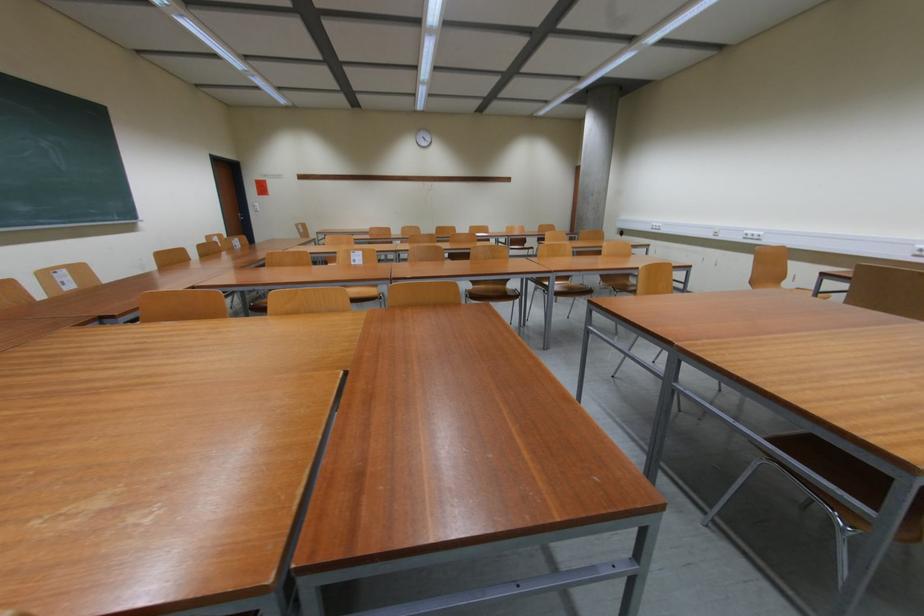
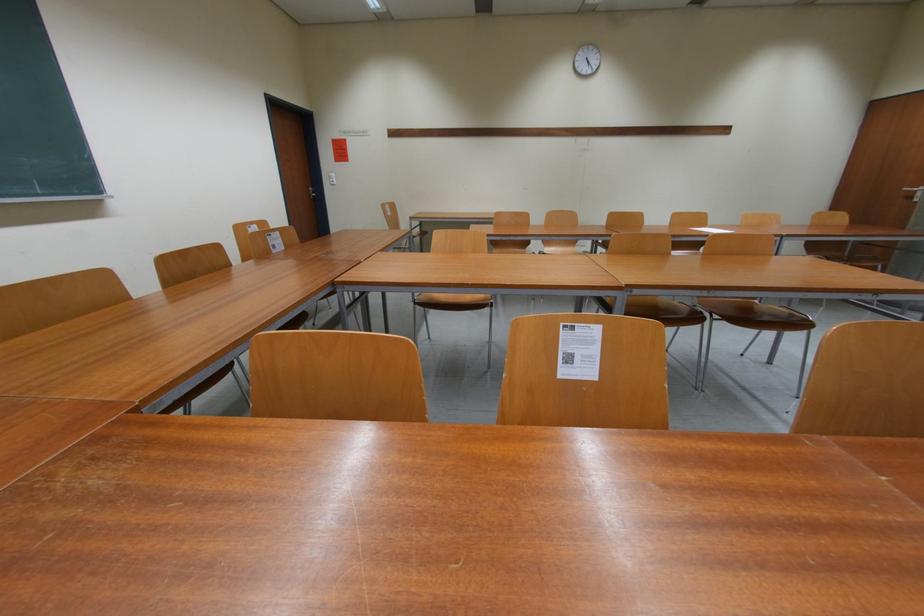
The images are taken continuously from a first-person perspective. In which direction are you moving?

The movement direction of the cameraman is left, forward.